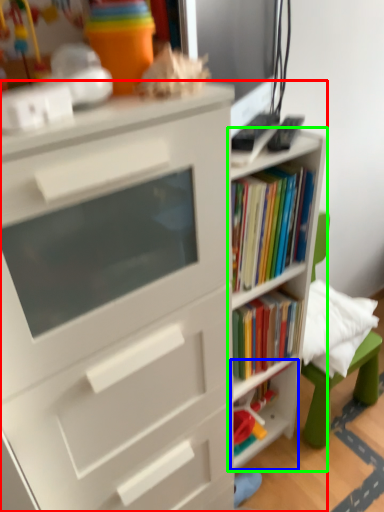
Question: Which object is positioned closest to bookcase (highlighted by a red box)? Select from shelf (highlighted by a blue box) and shelf (highlighted by a green box).

Choices:
 (A) shelf
 (B) shelf

Answer: (B)